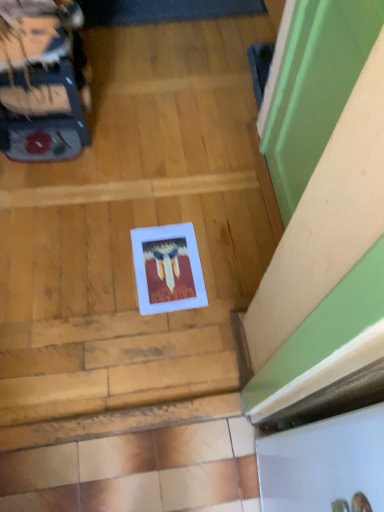
The height and width of the screenshot is (512, 384). In order to click on matte black suitcase at left in this screenshot , I will do `click(42, 80)`.

This screenshot has width=384, height=512. What do you see at coordinates (42, 80) in the screenshot?
I see `matte black suitcase at left` at bounding box center [42, 80].

Where is `matte black suitcase at left`? This screenshot has width=384, height=512. matte black suitcase at left is located at coordinates (42, 80).